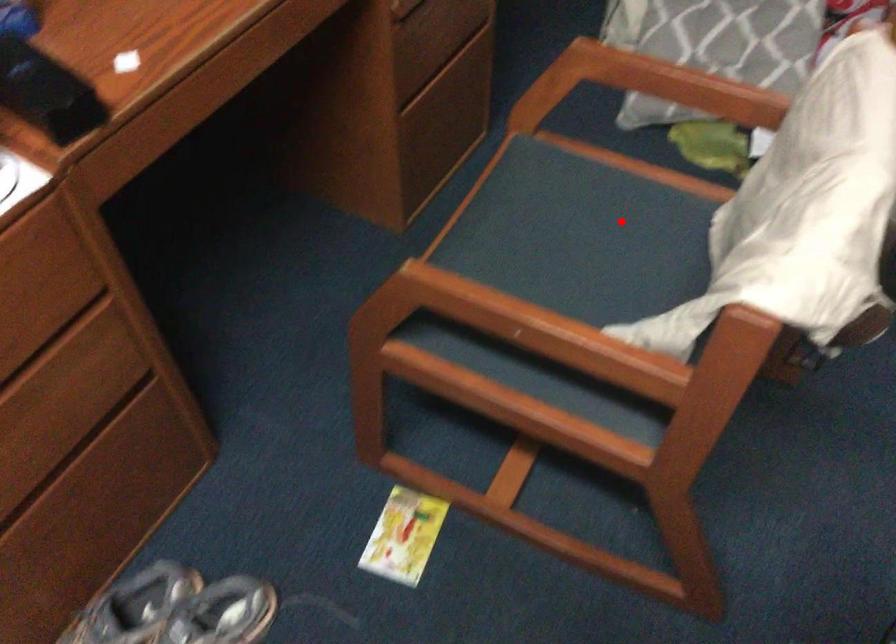
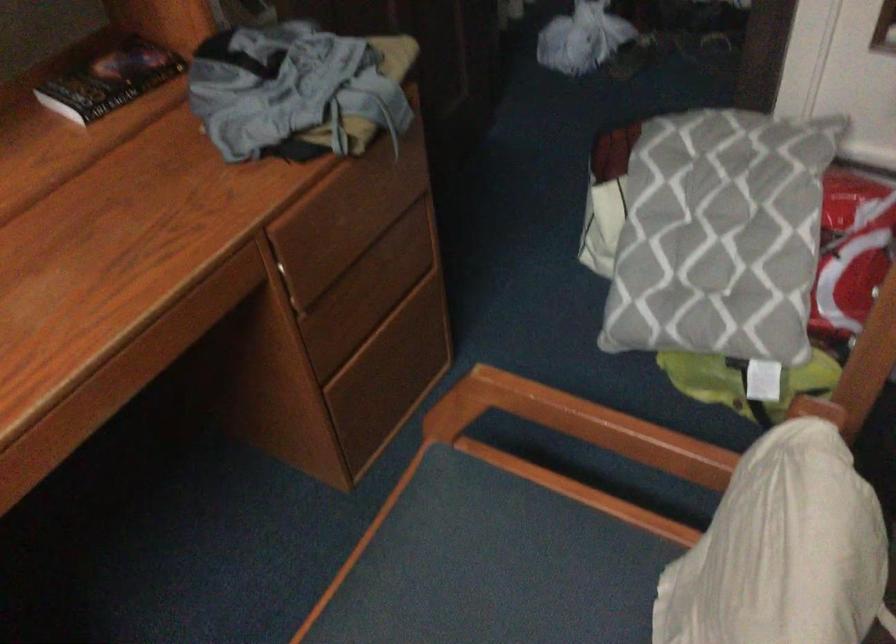
Question: I am providing you with two images of the same scene from different viewpoints. A red point is shown in image1. For the corresponding object point in image2, is it positioned nearer or farther from the camera?

Choices:
 (A) Nearer
 (B) Farther

Answer: (A)